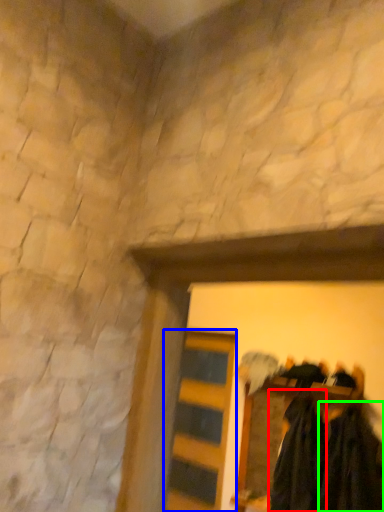
Question: Estimate the real-world distances between objects in this image. Which object is closer to clothing (highlighted by a red box), barn door (highlighted by a blue box) or clothing (highlighted by a green box)?

Choices:
 (A) barn door
 (B) clothing

Answer: (B)